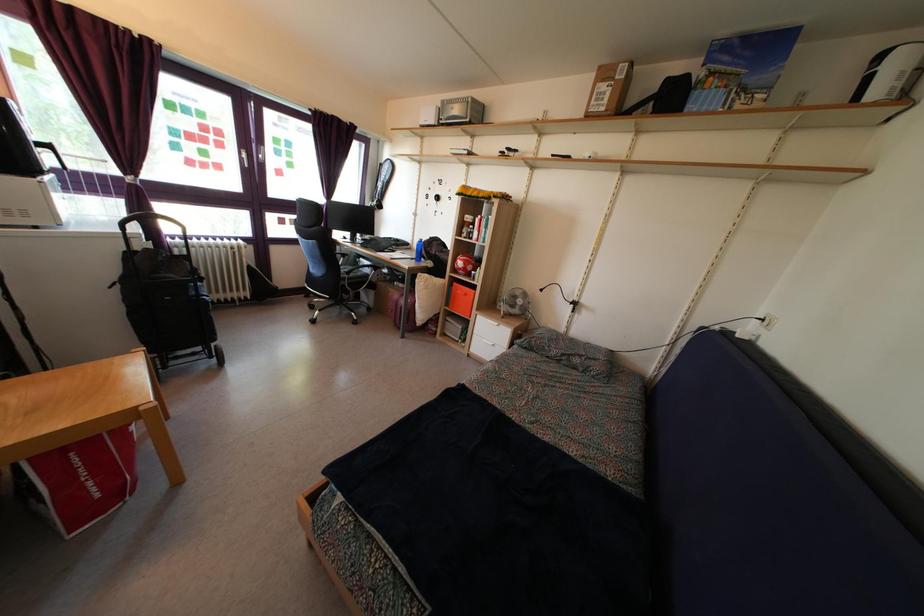
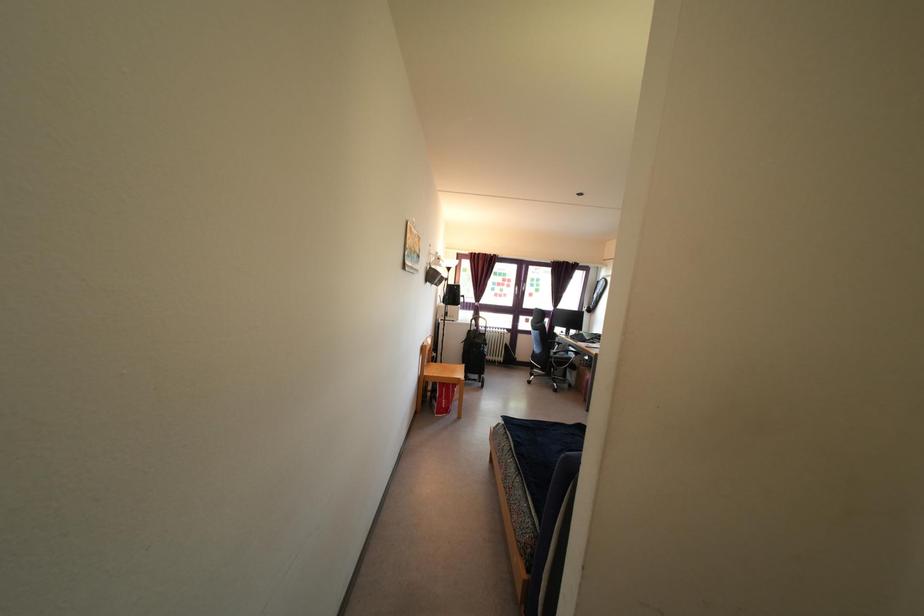
Where in the second image is the point corresponding to point (350, 282) from the first image?

(557, 362)